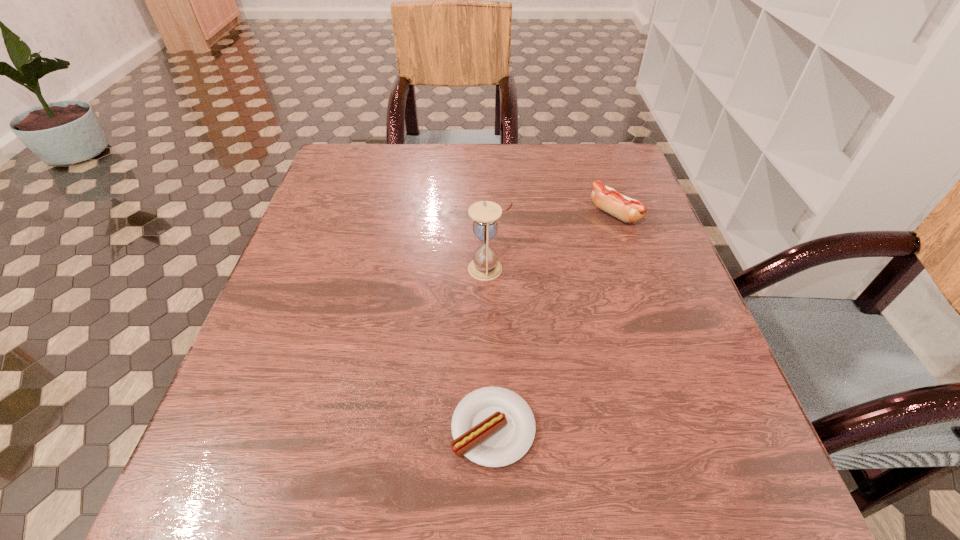
Identify the location of free space that satisfies the following two spatial constraints: 1. on the back side of the second shortest object; 2. on the left side of the second nearest object. click(488, 214).

The height and width of the screenshot is (540, 960). In order to click on free location that satisfies the following two spatial constraints: 1. on the back side of the left sausage; 2. on the right side of the farther sausage in this screenshot , I will do click(489, 214).

You are a GUI agent. You are given a task and a screenshot of the screen. Output one action in this format:
    pyautogui.click(x=<x>, y=<y>)
    Task: Click on the vacant space that satisfies the following two spatial constraints: 1. on the back side of the shortest object; 2. on the right side of the taller sausage
    
    Given the screenshot: What is the action you would take?
    pyautogui.click(x=489, y=214)

The width and height of the screenshot is (960, 540). In order to click on vacant space that satisfies the following two spatial constraints: 1. on the back side of the farthest object; 2. on the left side of the hourglass in this screenshot , I will do `click(488, 214)`.

The height and width of the screenshot is (540, 960). Find the location of `vacant space that satisfies the following two spatial constraints: 1. on the back side of the shortest object; 2. on the right side of the rightmost object`. vacant space that satisfies the following two spatial constraints: 1. on the back side of the shortest object; 2. on the right side of the rightmost object is located at coordinates (x=489, y=214).

In order to click on free space in the image that satisfies the following two spatial constraints: 1. on the back side of the right sausage; 2. on the right side of the second nearest object in this screenshot , I will do `click(488, 214)`.